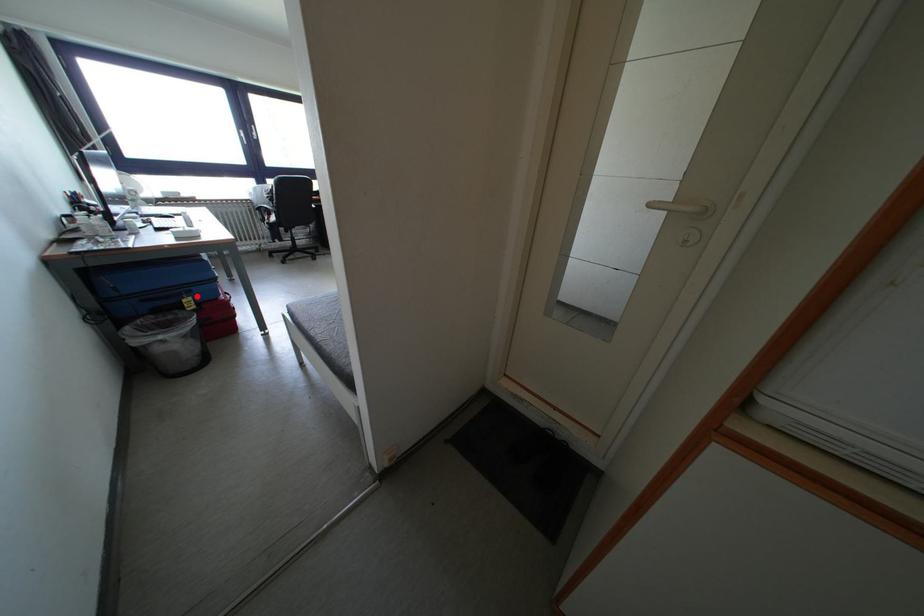
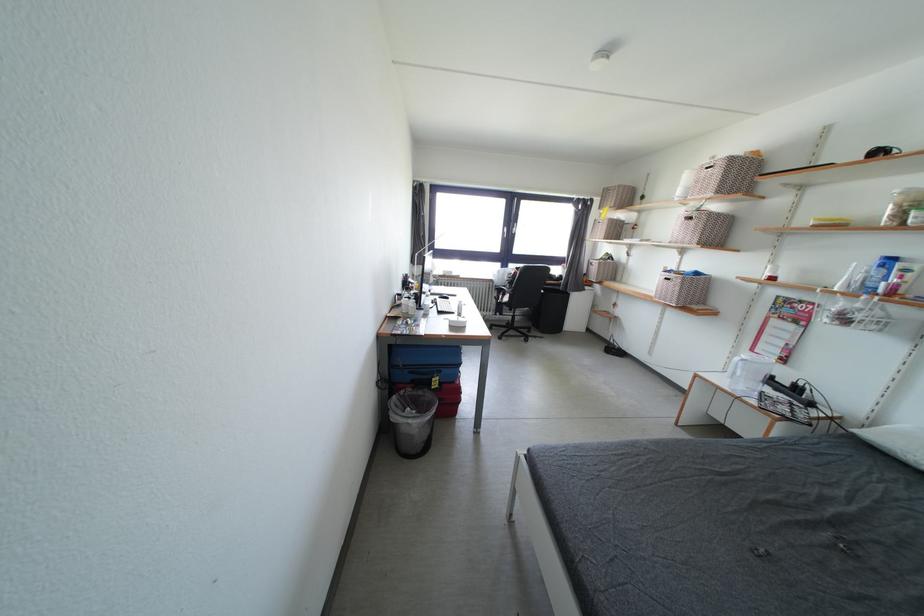
In the second image, find the point that corresponds to the highlighted location in the first image.

(446, 377)